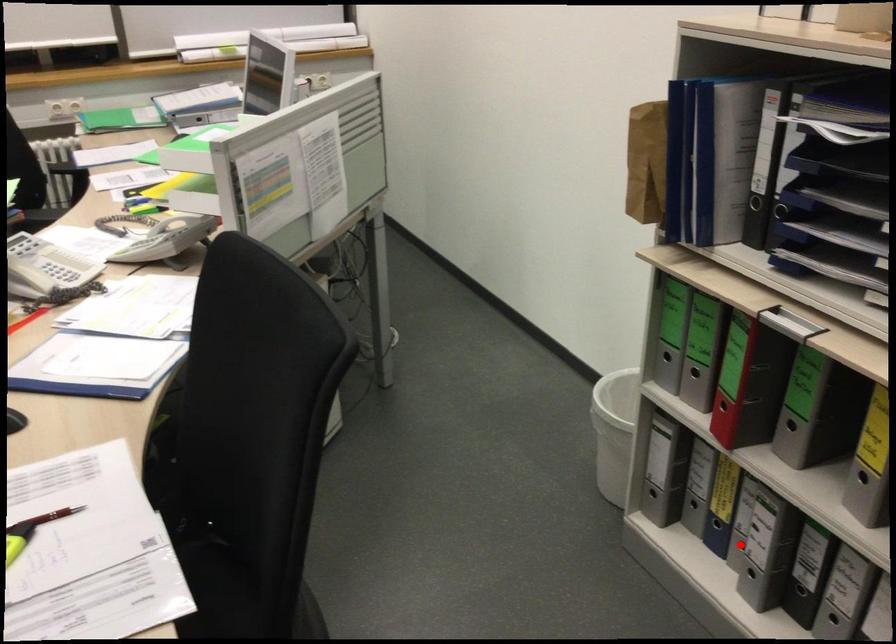
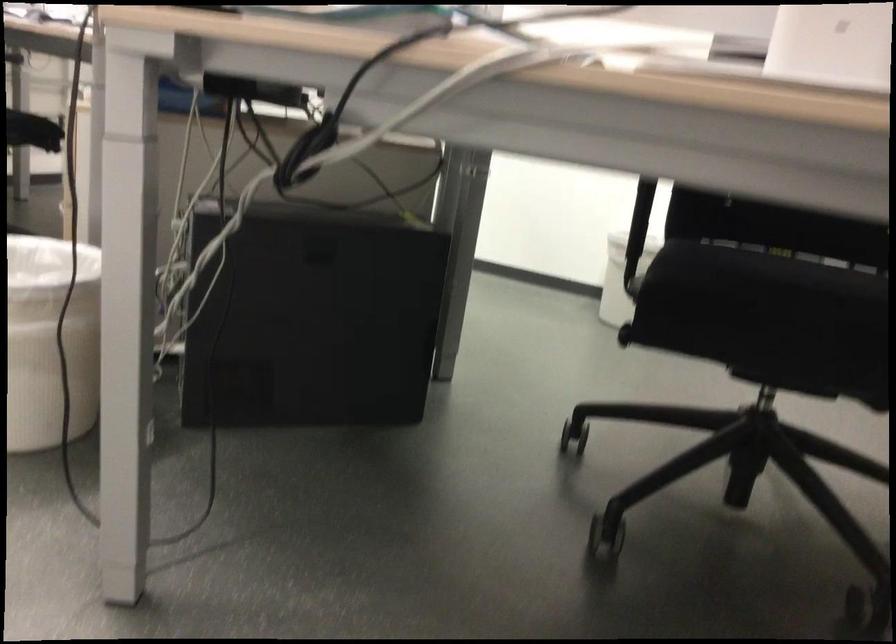
Question: I am providing you with two images of the same scene from different viewpoints. A red point is marked on the first image. Is the red point's position out of view in image 2?

Choices:
 (A) Yes
 (B) No

Answer: (A)